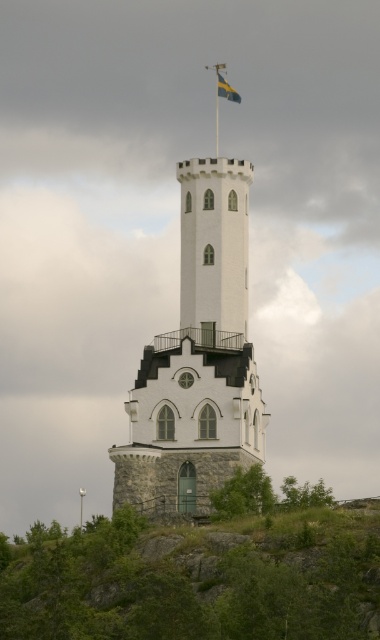
Question: Which point is farther from the camera taking this photo?

Choices:
 (A) (215, 112)
 (B) (237, 97)

Answer: (A)

Question: Which point is closer to the camera?

Choices:
 (A) (232, 433)
 (B) (231, 92)
 (C) (216, 96)
 (D) (310, 547)

Answer: (D)

Question: Can you confirm if white stone spire at center is bigger than metallic flag pole at top?

Choices:
 (A) yes
 (B) no

Answer: (A)

Question: Does white stone spire at center appear on the right side of metallic flag pole at top?

Choices:
 (A) no
 (B) yes

Answer: (A)

Question: Does green grassy hillside at lower center appear under white stone spire at center?

Choices:
 (A) no
 (B) yes

Answer: (B)

Question: Which object is positioned farthest from the metallic flag pole at top?

Choices:
 (A) white stone spire at center
 (B) blue and yellow striped fabric at top center
 (C) green grassy hillside at lower center

Answer: (C)